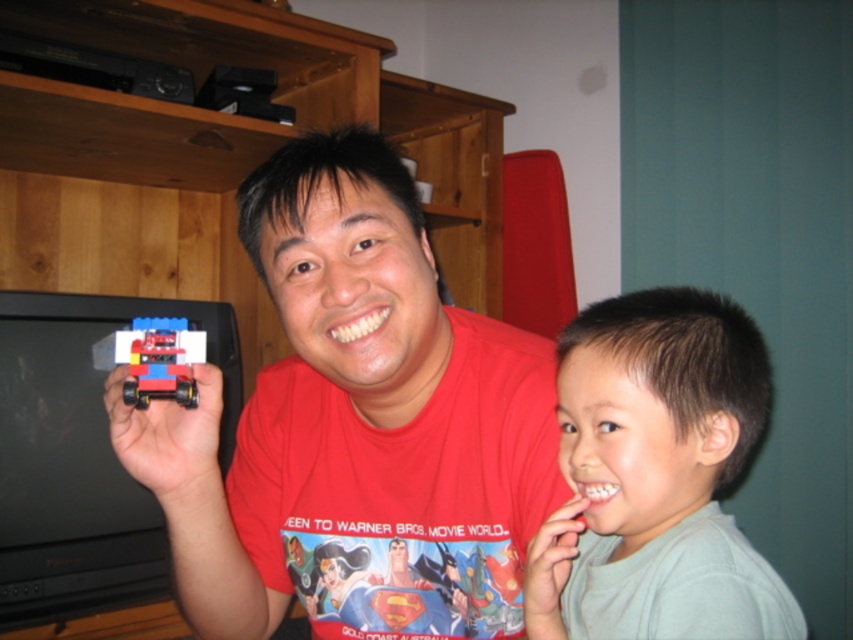
Based on the scene description, can you determine which object is taller between the matte plastic toy car at left and the light gray cotton shirt at right?

The matte plastic toy car at left is taller than the light gray cotton shirt at right according to the description.